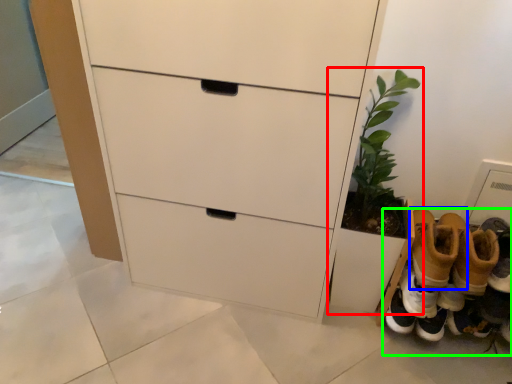
Question: Which is farther away from houseplant (highlighted by a red box)? footwear (highlighted by a blue box) or footwear (highlighted by a green box)?

Choices:
 (A) footwear
 (B) footwear

Answer: (B)